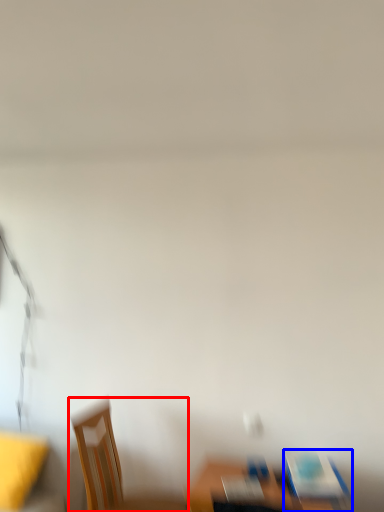
Question: Which of the following is the closest to the observer, chair (highlighted by a red box) or chair (highlighted by a blue box)?

Choices:
 (A) chair
 (B) chair

Answer: (B)